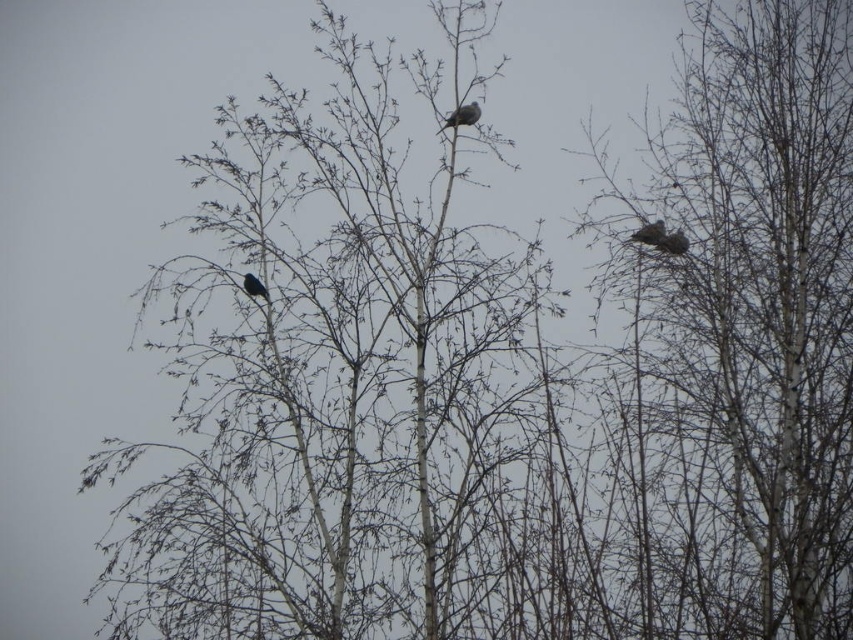
Consider the image. Is brown fuzzy nest at upper right to the right of gray matte bird at upper center from the viewer's perspective?

Yes, brown fuzzy nest at upper right is to the right of gray matte bird at upper center.

Can you confirm if brown fuzzy nest at upper right is wider than gray matte bird at upper center?

Incorrect, brown fuzzy nest at upper right's width does not surpass gray matte bird at upper center's.

Is point (646, 237) in front of point (467, 104)?

No, (646, 237) is further to viewer.

This screenshot has width=853, height=640. I want to click on brown fuzzy nest at upper right, so click(x=651, y=234).

Is brown speckled feather at right positioned at the back of brown fuzzy nest at upper right?

Yes, brown speckled feather at right is behind brown fuzzy nest at upper right.

Which is above, brown speckled feather at right or brown fuzzy nest at upper right?

brown speckled feather at right is above.

Based on the photo, who is more distant from viewer, [656,228] or [654,225]?

Positioned behind is point [654,225].

Where is `brown speckled feather at right`? brown speckled feather at right is located at coordinates (660, 237).

Does point (611, 232) come in front of point (647, 243)?

No, it is behind (647, 243).

Does point (614, 547) come closer to viewer compared to point (647, 225)?

No, it is not.

Image resolution: width=853 pixels, height=640 pixels. In order to click on bare branches at upper center in this screenshot , I will do `click(746, 332)`.